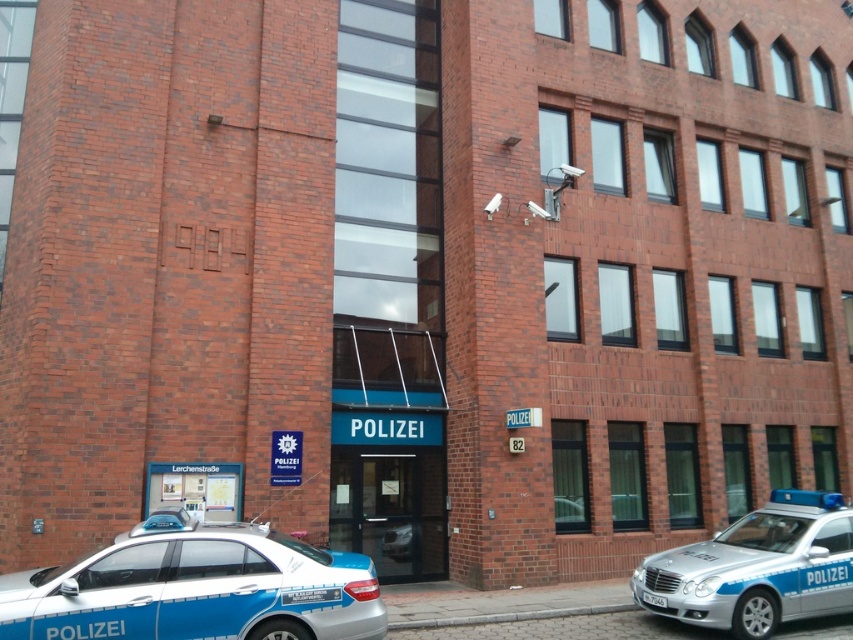
Question: Among these objects, which one is nearest to the camera?

Choices:
 (A) silver metallic police car at lower right
 (B) blue metallic police car at lower left

Answer: (B)

Question: Which object appears closest to the camera in this image?

Choices:
 (A) silver metallic police car at lower right
 (B) blue metallic police car at lower left

Answer: (B)

Question: Is blue metallic police car at lower left wider than silver metallic police car at lower right?

Choices:
 (A) no
 (B) yes

Answer: (B)

Question: Which object appears closest to the camera in this image?

Choices:
 (A) silver metallic police car at lower right
 (B) blue metallic police car at lower left

Answer: (B)

Question: Is the position of blue metallic police car at lower left more distant than that of silver metallic police car at lower right?

Choices:
 (A) no
 (B) yes

Answer: (A)

Question: Can you confirm if blue metallic police car at lower left is positioned above silver metallic police car at lower right?

Choices:
 (A) yes
 (B) no

Answer: (A)